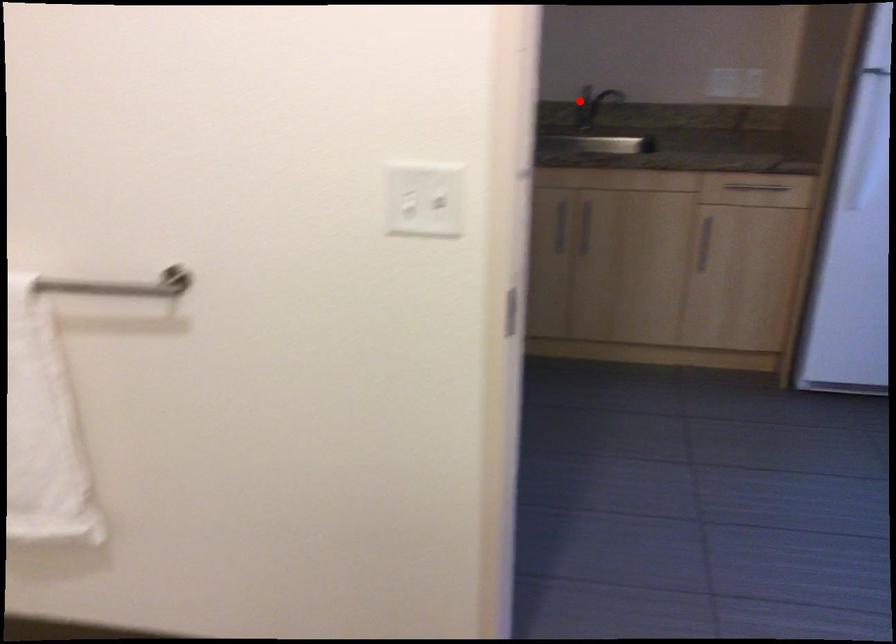
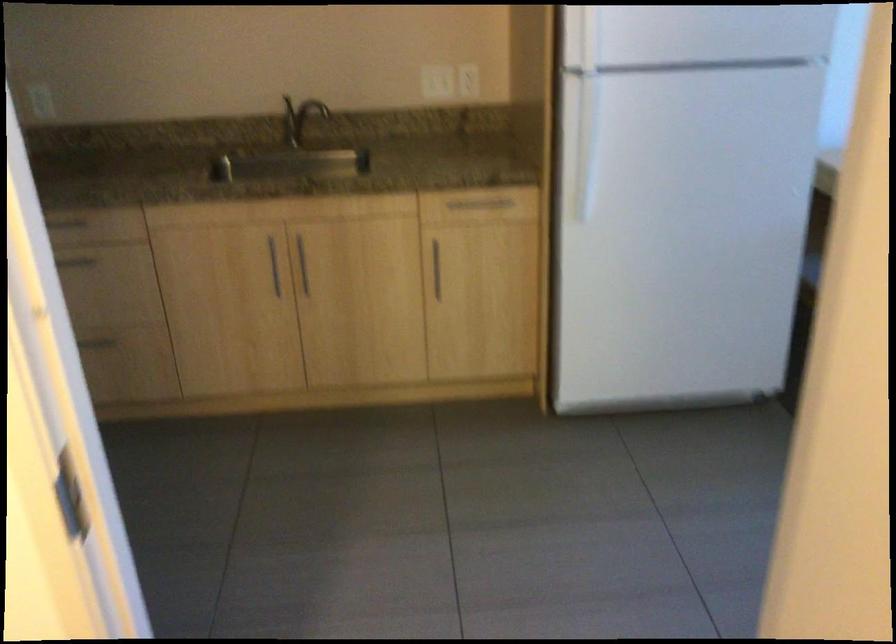
Question: I am providing you with two images of the same scene from different viewpoints. Given a red point in image1, look at the same physical point in image2. Is it:

Choices:
 (A) Closer to the viewpoint
 (B) Farther from the viewpoint

Answer: (A)